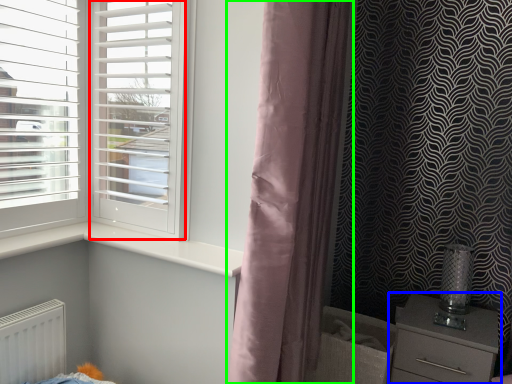
Question: Based on their relative distances, which object is nearer to screen door (highlighted by a red box)? Choose from chest of drawers (highlighted by a blue box) and curtain (highlighted by a green box).

Choices:
 (A) chest of drawers
 (B) curtain

Answer: (B)